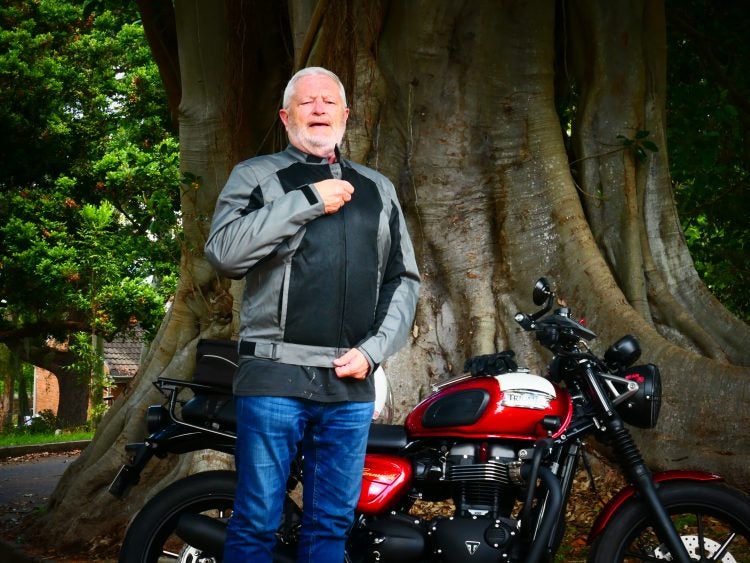
At what (x,y) coordinates should I click in order to perform the action: click on rack. Please return your answer as a coordinate pair (x, y). Looking at the image, I should click on (198, 397).